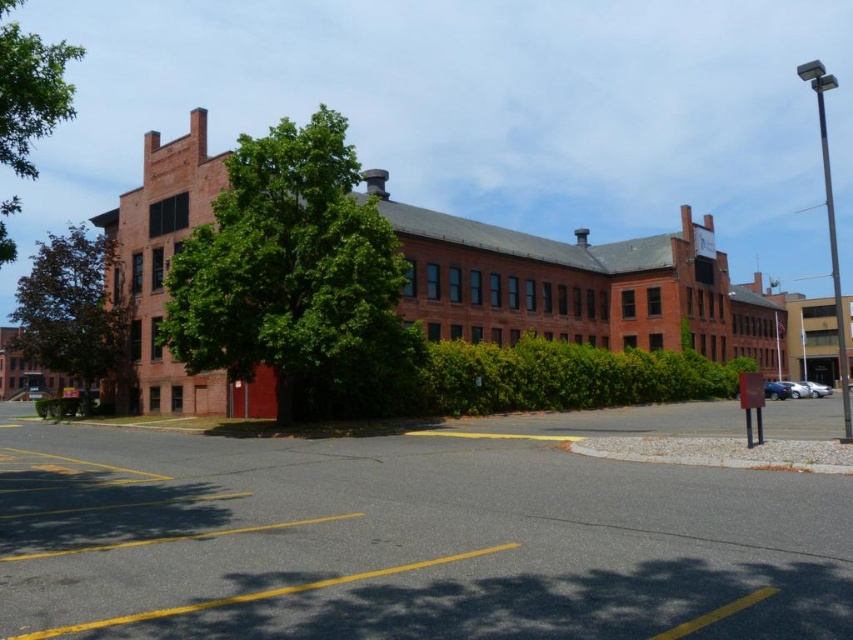
Question: Is black asphalt parking lot at center in front of green leafy tree at center?

Choices:
 (A) yes
 (B) no

Answer: (A)

Question: Based on their relative distances, which object is farther from the green leafy tree at center?

Choices:
 (A) black asphalt parking lot at center
 (B) green leafy tree at upper left

Answer: (B)

Question: Among these objects, which one is farthest from the camera?

Choices:
 (A) green leafy tree at center
 (B) black asphalt parking lot at center

Answer: (A)

Question: Considering the real-world distances, which object is closest to the black asphalt parking lot at center?

Choices:
 (A) green leafy tree at left
 (B) green leafy tree at upper left

Answer: (B)

Question: Does black asphalt parking lot at center come in front of green leafy tree at left?

Choices:
 (A) no
 (B) yes

Answer: (B)

Question: Considering the relative positions of black asphalt parking lot at center and green leafy tree at left in the image provided, where is black asphalt parking lot at center located with respect to green leafy tree at left?

Choices:
 (A) right
 (B) left

Answer: (A)